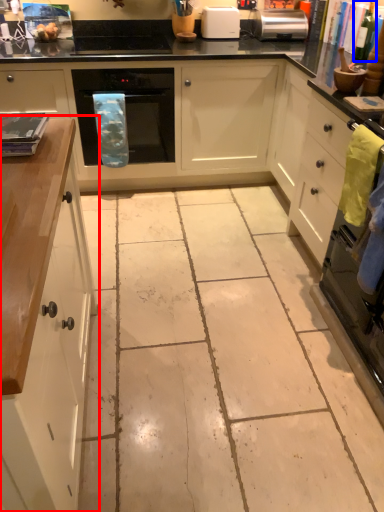
Question: Among these objects, which one is nearest to the camera, cabinetry (highlighted by a red box) or bottle (highlighted by a blue box)?

Choices:
 (A) cabinetry
 (B) bottle

Answer: (A)